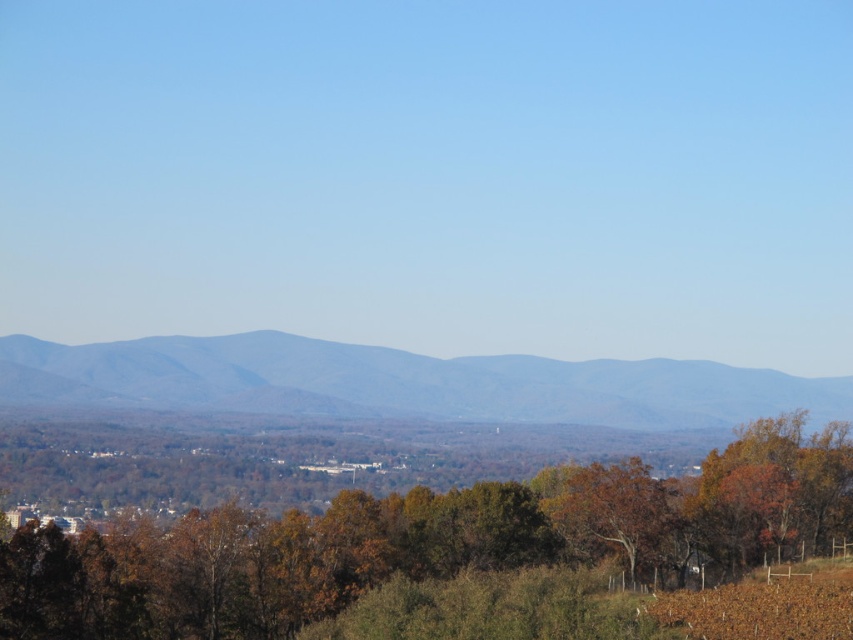
Question: Can you confirm if brown matte tree at lower center is positioned to the right of grayish-blue textured mountain at center?

Choices:
 (A) yes
 (B) no

Answer: (A)

Question: Does brown matte tree at lower center come behind grayish-blue textured mountain at center?

Choices:
 (A) yes
 (B) no

Answer: (B)

Question: Which point is farther to the camera?

Choices:
 (A) (248, 374)
 (B) (368, 556)

Answer: (A)

Question: Which of the following is the farthest from the observer?

Choices:
 (A) (332, 349)
 (B) (9, 564)

Answer: (A)

Question: Where is brown matte tree at lower center located in relation to grayish-blue textured mountain at center in the image?

Choices:
 (A) above
 (B) below

Answer: (B)